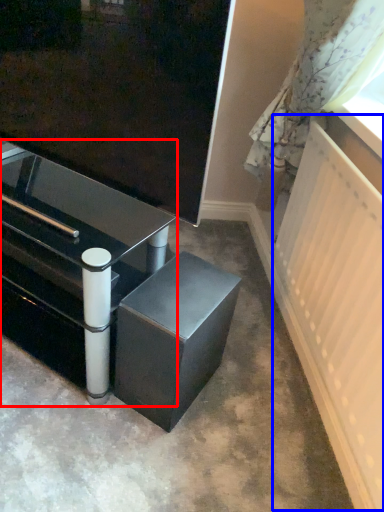
Question: Which point is closer to the camera, table (highlighted by a red box) or radiator (highlighted by a blue box)?

Choices:
 (A) table
 (B) radiator

Answer: (B)